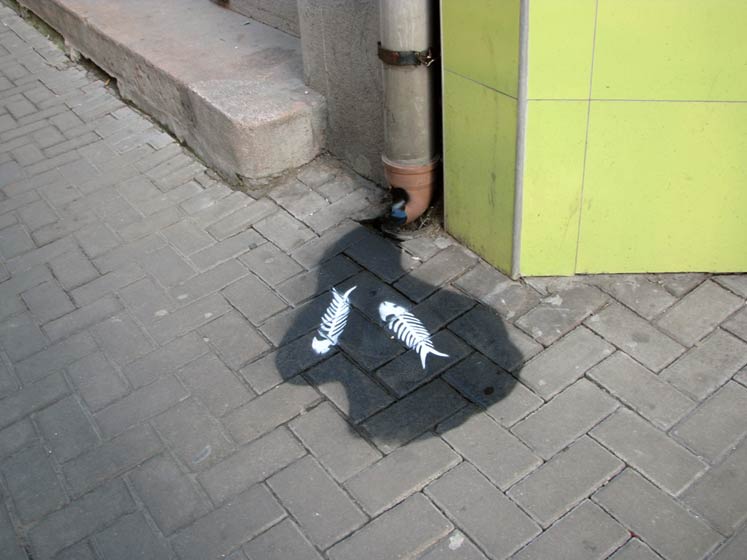
Where is `yellow wall`? yellow wall is located at coordinates point(641,52), point(495,67).